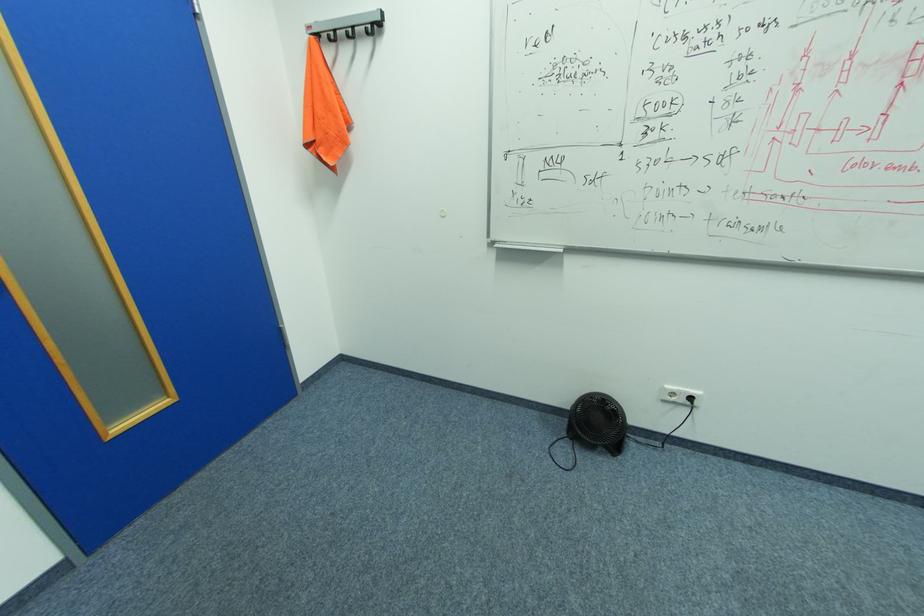
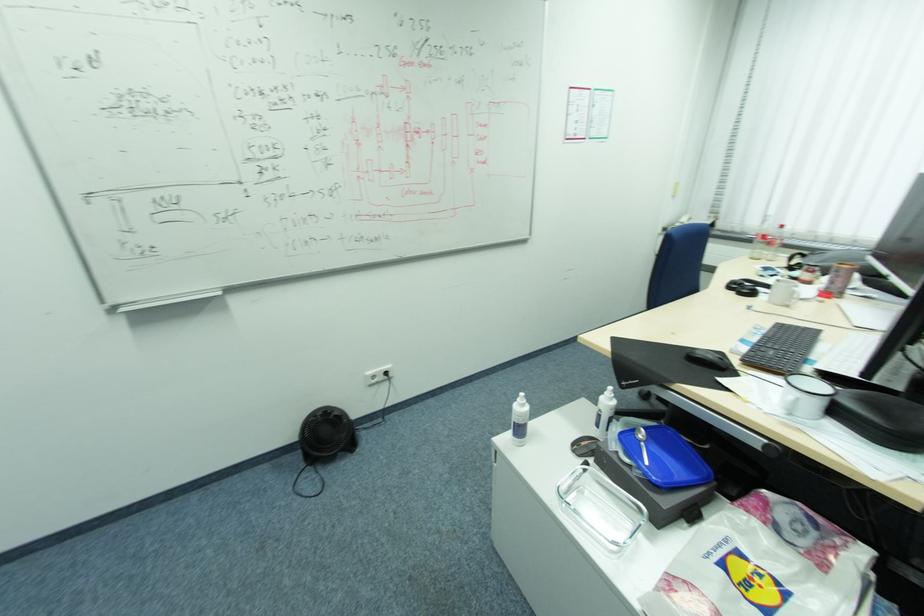
The point at (568, 423) is marked in the first image. Where is the corresponding point in the second image?

(304, 456)